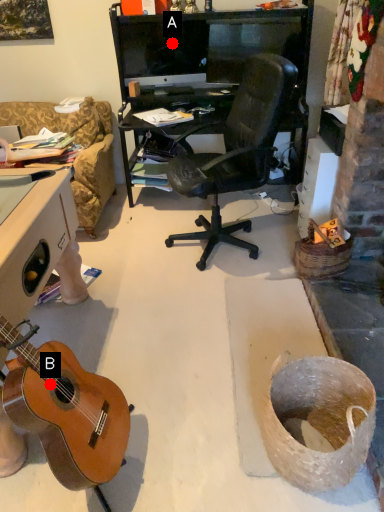
Question: Two points are circled on the image, labeled by A and B beside each circle. Among these points, which one is nearest to the camera?

Choices:
 (A) A is closer
 (B) B is closer

Answer: (B)